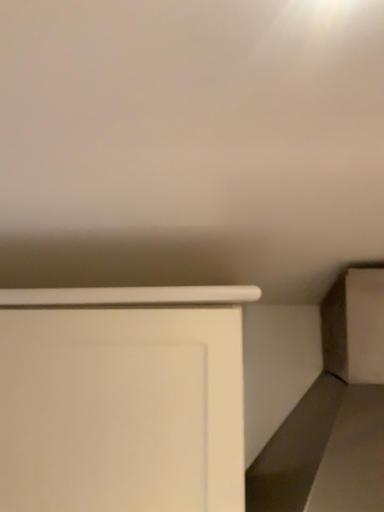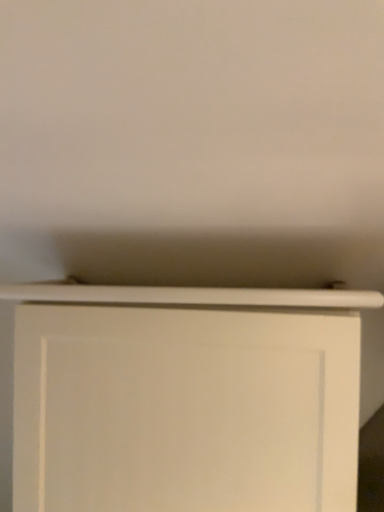
Question: How did the camera likely rotate when shooting the video?

Choices:
 (A) rotated upward
 (B) rotated downward

Answer: (B)